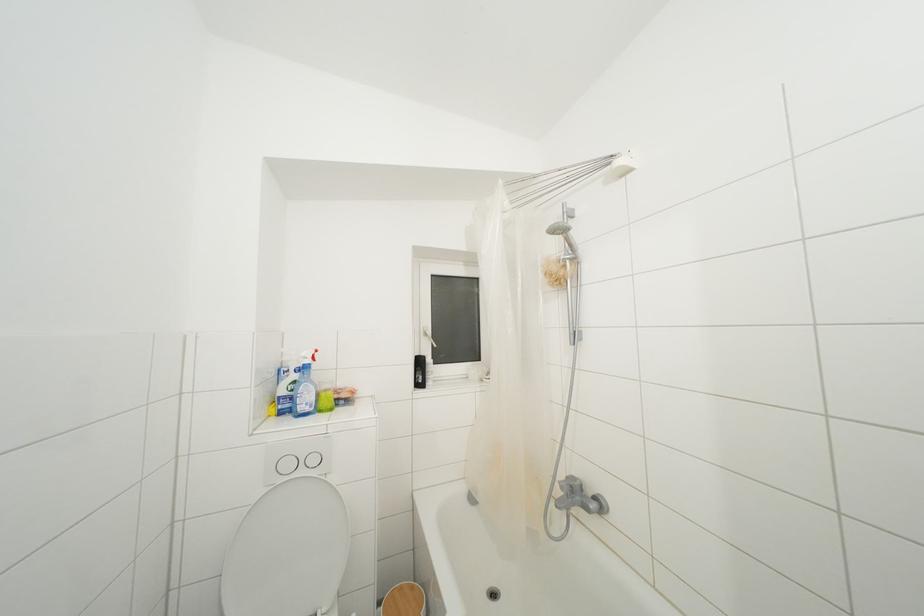
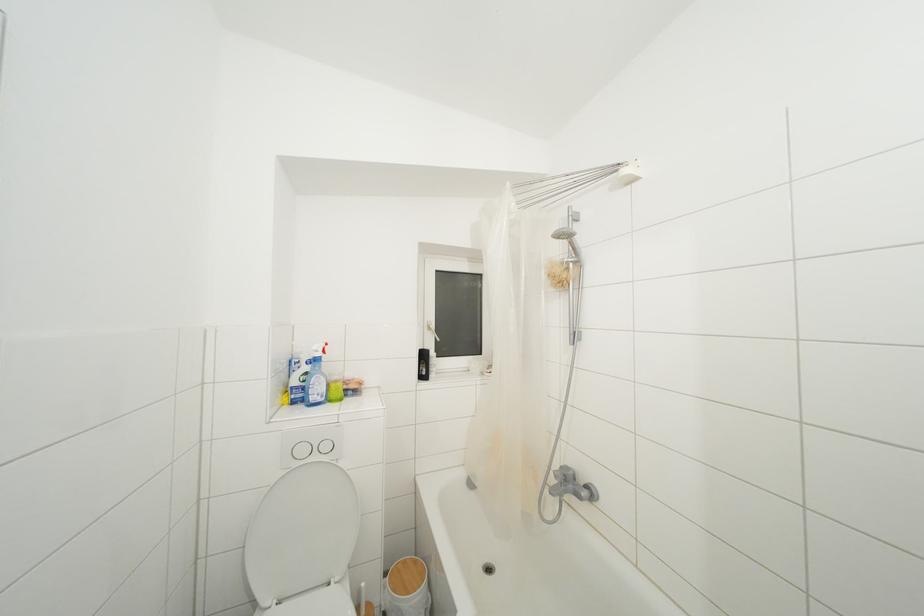
Find the pixel in the second image that matches the point at 576,491 in the first image.

(568, 480)